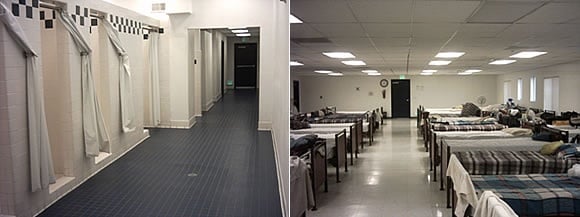
In order to click on bed in this screenshot , I will do `click(508, 206)`.